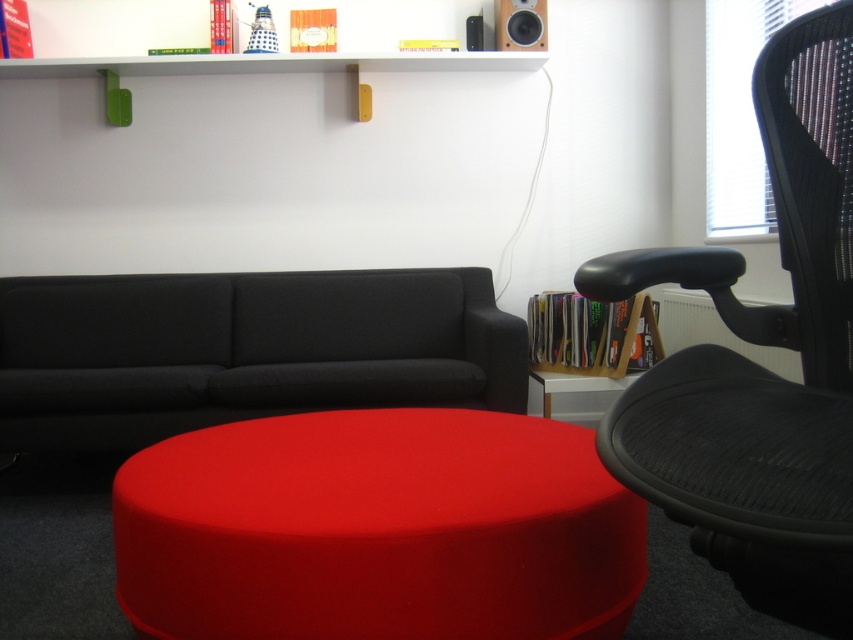
You are a guest entering the living room and want to place your bag on the nearest flat surface. The matte red ottoman at center and the white glossy side table at lower center are both available. Which one should you choose based on their positions?

The matte red ottoman at center is to the left of white glossy side table at lower center, so the white glossy side table at lower center is closer to the entrance. You should choose the white glossy side table at lower center to place your bag.

What are the coordinates of the dark gray fabric couch at center?

The dark gray fabric couch at center is located at coordinates point (x=242, y=349).

You are a delivery person carrying a package that requires placing on a surface between the matte red ottoman at center and the white glossy side table at lower center. The package is 1.5 meters long. Can you place it horizontally between them without bending?

The distance between the matte red ottoman at center and the white glossy side table at lower center is 1.26 meters, which is shorter than the package length of 1.5 meters. Therefore, the package cannot be placed horizontally between them without bending.